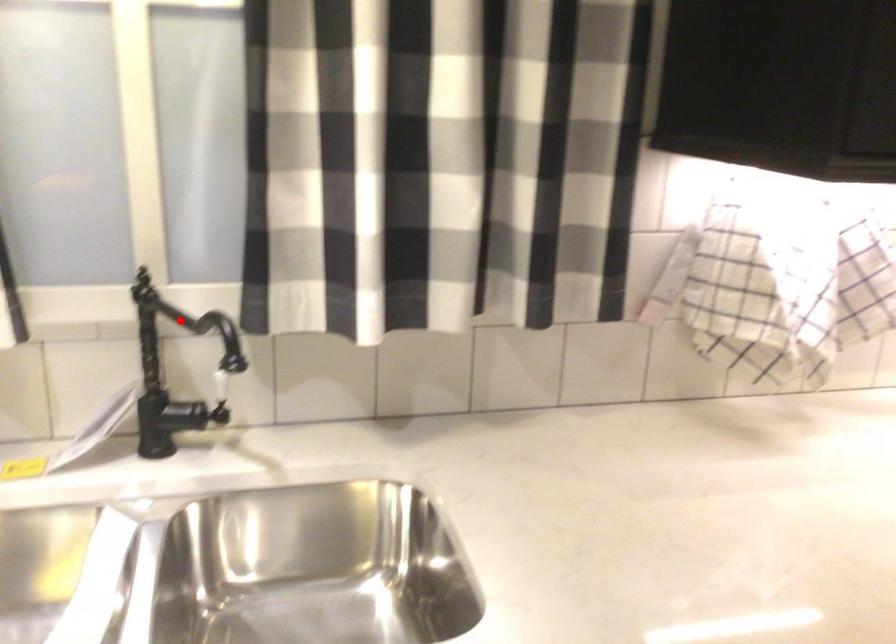
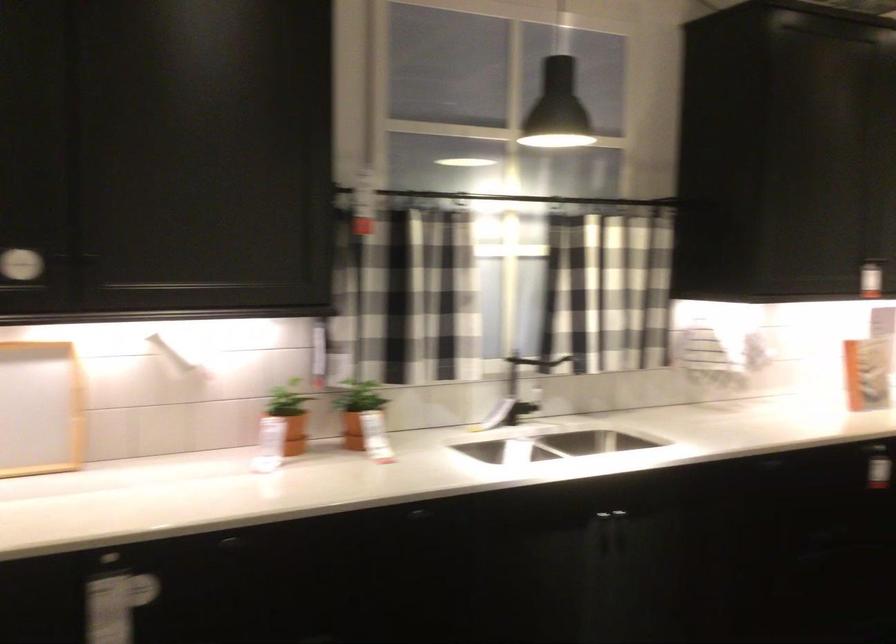
Question: A red point is marked in image1. In image2, is the corresponding 3D point closer to the camera or farther? Reply with the corresponding letter.

Choices:
 (A) The corresponding 3D point is closer.
 (B) The corresponding 3D point is farther.

Answer: (B)